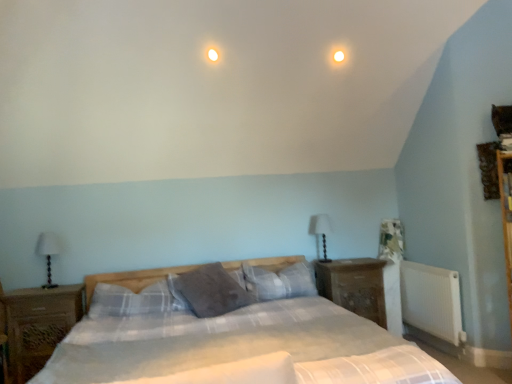
Question: Is the depth of plaid fabric pillow at center, marked as the third pillow in a left-to-right arrangement, greater than that of white fabric-covered table lamp at center-right, the second table lamp from the front?

Choices:
 (A) no
 (B) yes

Answer: (A)

Question: Does plaid fabric pillow at center, the 1th pillow positioned from the right, have a greater height compared to white fabric-covered table lamp at center-right, the 1th table lamp when ordered from back to front?

Choices:
 (A) yes
 (B) no

Answer: (B)

Question: Is plaid fabric pillow at center, marked as the third pillow in a left-to-right arrangement, located outside white fabric-covered table lamp at center-right, which is the first table lamp from right to left?

Choices:
 (A) yes
 (B) no

Answer: (A)

Question: Is plaid fabric pillow at center, the 1th pillow positioned from the right, far from white fabric-covered table lamp at center-right, the second table lamp from the front?

Choices:
 (A) yes
 (B) no

Answer: (B)

Question: From the image's perspective, is plaid fabric pillow at center, the 1th pillow positioned from the right, over white fabric-covered table lamp at center-right, which is the first table lamp from right to left?

Choices:
 (A) no
 (B) yes

Answer: (A)

Question: Does point (71, 359) appear closer or farther from the camera than point (335, 56)?

Choices:
 (A) farther
 (B) closer

Answer: (B)

Question: Considering the positions of plaid fabric bed at center and white glossy light at upper center in the image, is plaid fabric bed at center taller or shorter than white glossy light at upper center?

Choices:
 (A) short
 (B) tall

Answer: (B)

Question: Would you say plaid fabric bed at center is inside or outside white glossy light at upper center?

Choices:
 (A) inside
 (B) outside

Answer: (B)

Question: Looking at the image, does plaid fabric bed at center seem bigger or smaller compared to white glossy light at upper center?

Choices:
 (A) small
 (B) big

Answer: (B)

Question: Choose the correct answer: Is plaid fabric pillow at center, which is the third pillow from right to left, inside wooden nightstand at left, marked as the 2th nightstand in a back-to-front arrangement, or outside it?

Choices:
 (A) outside
 (B) inside

Answer: (A)

Question: Based on their sizes in the image, would you say plaid fabric pillow at center, which is the third pillow from right to left, is bigger or smaller than wooden nightstand at left, which is the second nightstand from right to left?

Choices:
 (A) big
 (B) small

Answer: (B)

Question: Is point (92, 311) positioned closer to the camera than point (48, 299)?

Choices:
 (A) farther
 (B) closer

Answer: (A)

Question: Is plaid fabric pillow at center, the 1th pillow from the left, in front of or behind wooden nightstand at left, marked as the 2th nightstand in a back-to-front arrangement, in the image?

Choices:
 (A) front
 (B) behind

Answer: (B)

Question: Choose the correct answer: Is white fabric-covered table lamp at center-right, which is the first table lamp from right to left, inside wooden nightstand at left, marked as the 2th nightstand in a back-to-front arrangement, or outside it?

Choices:
 (A) inside
 (B) outside

Answer: (B)

Question: Considering their positions, is white fabric-covered table lamp at center-right, the 1th table lamp when ordered from back to front, located in front of or behind wooden nightstand at left, positioned as the 1th nightstand in left-to-right order?

Choices:
 (A) front
 (B) behind

Answer: (B)